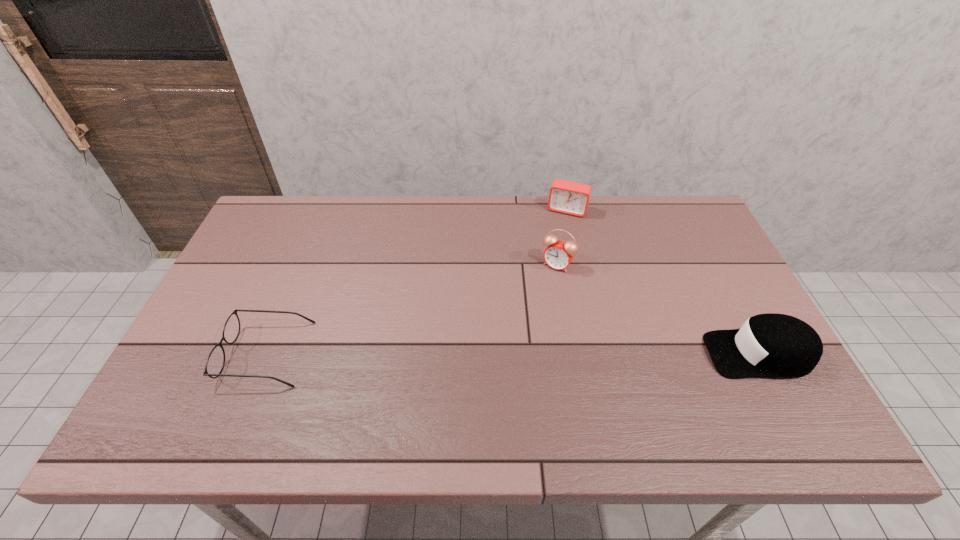
At what (x,y) coordinates should I click in order to perform the action: click on vacant space that's between the taller alarm clock and the farther alarm clock. Please return your answer as a coordinate pair (x, y). Looking at the image, I should click on (563, 238).

Where is `empty space between the shortest object and the tallest object`? empty space between the shortest object and the tallest object is located at coordinates coord(412,309).

At what (x,y) coordinates should I click in order to perform the action: click on empty space that is in between the shorter alarm clock and the rightmost object. Please return your answer as a coordinate pair (x, y). The width and height of the screenshot is (960, 540). Looking at the image, I should click on (662, 282).

This screenshot has height=540, width=960. In order to click on empty space between the shortest object and the taller alarm clock in this screenshot , I will do `click(412, 309)`.

Image resolution: width=960 pixels, height=540 pixels. I want to click on vacant area that lies between the rightmost object and the second farthest object, so click(658, 309).

Where is `free space between the spectacles and the cap`? The image size is (960, 540). free space between the spectacles and the cap is located at coordinates (513, 354).

Where is `free space between the spectacles and the farthest object`? The height and width of the screenshot is (540, 960). free space between the spectacles and the farthest object is located at coordinates (418, 282).

This screenshot has width=960, height=540. In order to click on free space between the shortest object and the rightmost object in this screenshot , I will do `click(513, 354)`.

Where is `free space between the rightmost object and the shorter alarm clock`? The width and height of the screenshot is (960, 540). free space between the rightmost object and the shorter alarm clock is located at coordinates (662, 282).

Identify which object is the second nearest to the cap. Please provide its 2D coordinates. Your answer should be formatted as a tuple, i.e. [(x, y)], where the tuple contains the x and y coordinates of a point satisfying the conditions above.

[(567, 197)]